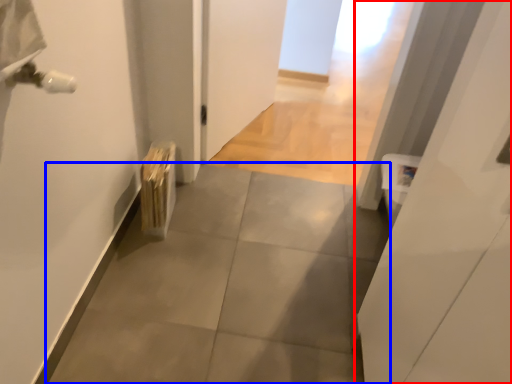
Question: Which object is further to the camera taking this photo, door (highlighted by a red box) or concrete (highlighted by a blue box)?

Choices:
 (A) door
 (B) concrete

Answer: (B)